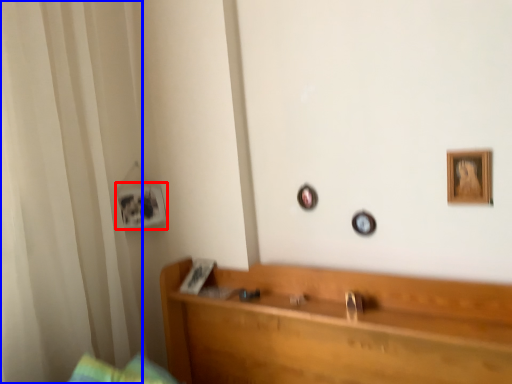
Question: Among these objects, which one is nearest to the camera, picture frame (highlighted by a red box) or curtain (highlighted by a blue box)?

Choices:
 (A) picture frame
 (B) curtain

Answer: (B)